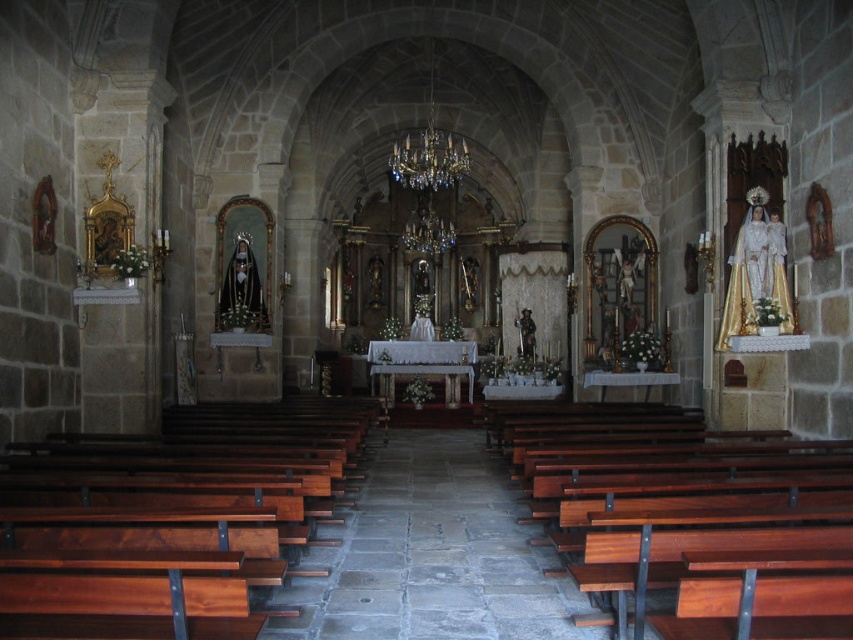
Is point (264, 476) in front of point (846, 467)?

Yes.

Is brown polished wood at left taller than polished wood bench at lower right?

Incorrect, brown polished wood at left's height is not larger of polished wood bench at lower right's.

What do you see at coordinates (167, 518) in the screenshot? I see `brown polished wood at left` at bounding box center [167, 518].

This screenshot has height=640, width=853. I want to click on brown polished wood at left, so coord(167,518).